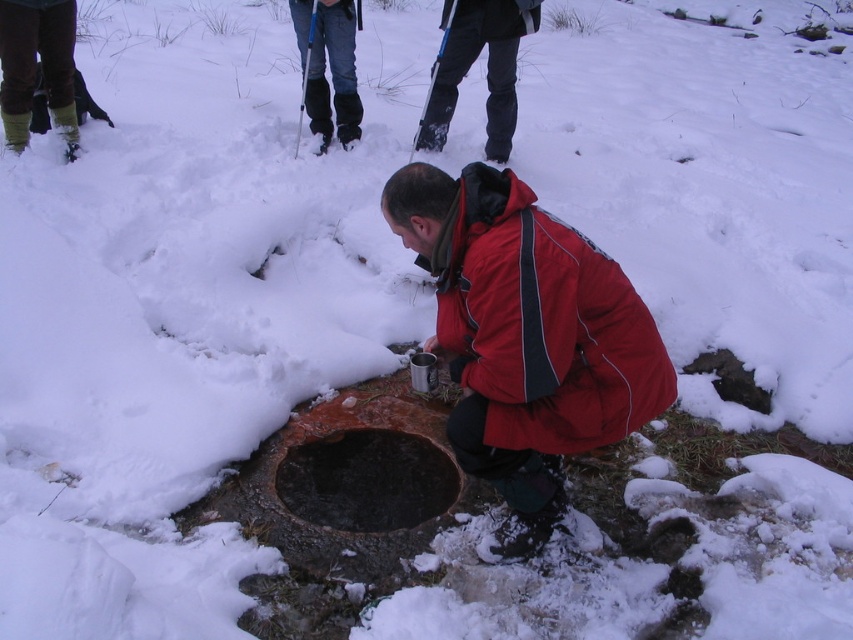
Question: Which object appears farthest from the camera in this image?

Choices:
 (A) black matte jacket at upper center
 (B) black rubber boots at upper center
 (C) dark brown stone hole at center
 (D) green rubber boots at upper left

Answer: (B)

Question: Which of these objects is positioned closest to the red matte jacket at center?

Choices:
 (A) black matte jacket at upper center
 (B) green rubber boots at upper left
 (C) dark gray snow pants at upper center

Answer: (C)

Question: In this image, where is black rubber boots at upper center located relative to rusty metal hole at lower center?

Choices:
 (A) left
 (B) right

Answer: (A)

Question: Is black matte jacket at upper center behind rusty metal hole at lower center?

Choices:
 (A) no
 (B) yes

Answer: (B)

Question: In this image, where is dark gray snow pants at upper center located relative to rusty metal hole at lower center?

Choices:
 (A) above
 (B) below

Answer: (A)

Question: Which object is farther from the camera taking this photo?

Choices:
 (A) green rubber boots at upper left
 (B) black matte jacket at upper center
 (C) dark brown stone hole at center
 (D) red matte jacket at center

Answer: (B)